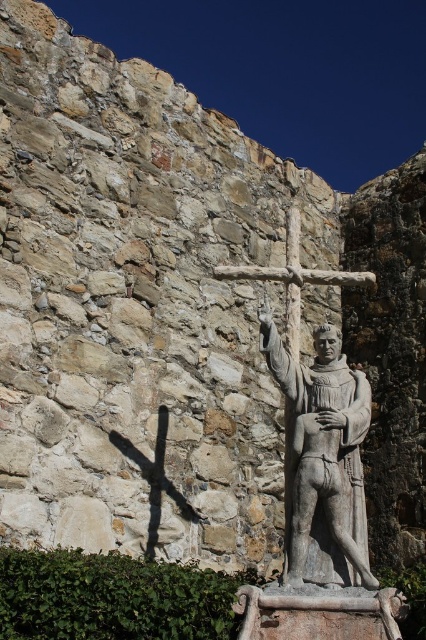
Looking at this image, you are standing in front of the stone statue and want to touch both points on the statue. Which point, point (340,540) or point (294,259), will you reach first?

Point (340,540) is closer to the viewer than point (294,259), so you will reach point (340,540) first.

You are standing in front of a stone wall with a statue. Where is the gray stone statue at center located in terms of coordinates?

The gray stone statue at center is located at coordinates point (322, 460).